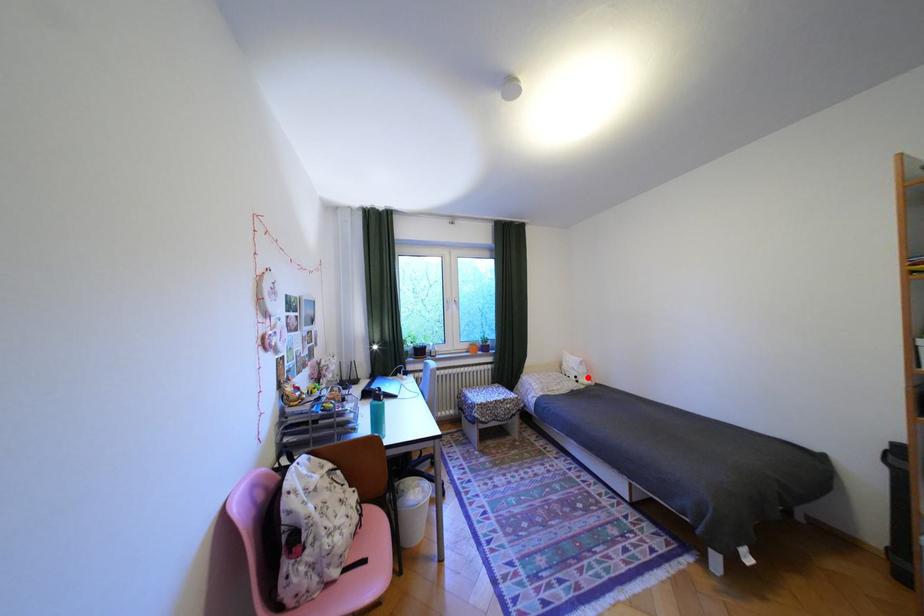
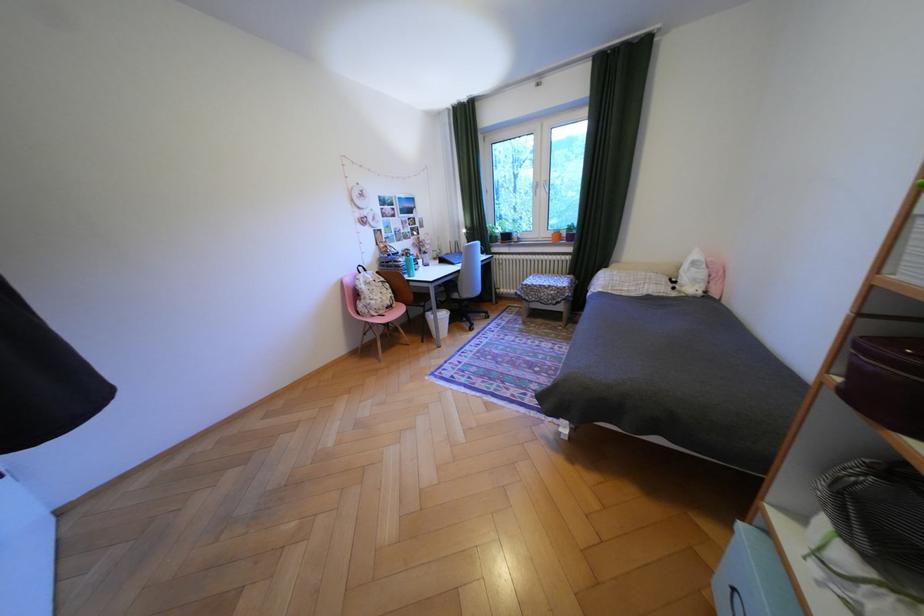
The point at the highlighted location is marked in the first image. Where is the corresponding point in the second image?

(687, 282)